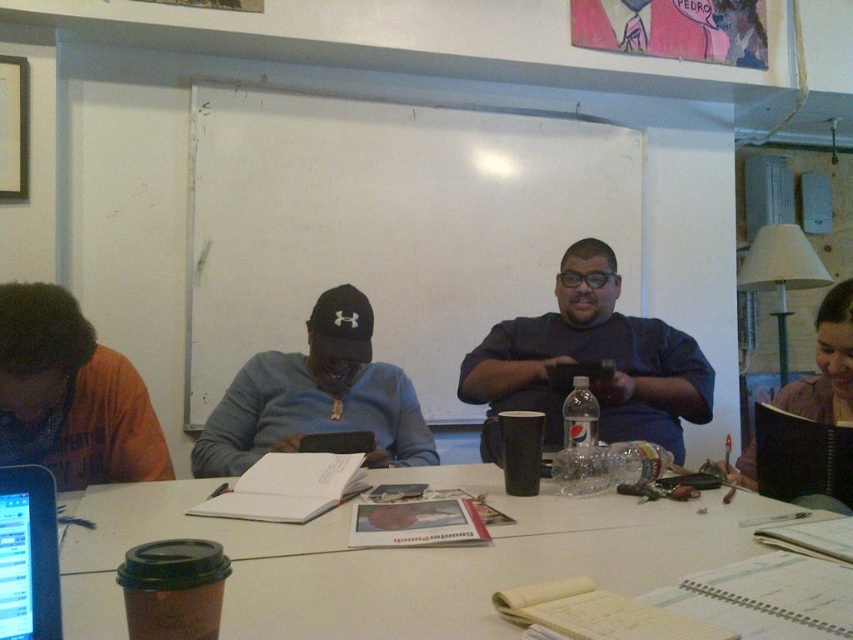
You are organizing the items on the table and need to place the pink fabric notebook at right in a position relative to the white matte whiteboard at center. Based on the scene description, where should you place it?

The white matte whiteboard at center is above the pink fabric notebook at right, so you should place the pink fabric notebook at right below the white matte whiteboard at center.

You are organizing a meeting in this room and need to place a new agenda sheet on the table. The black matte cap at center is blocking the space where you want to put it. Can you move the agenda sheet to the right side of the white matte whiteboard at center instead?

The white matte whiteboard at center is to the right of the black matte cap at center, so moving the agenda sheet to the right side of the white matte whiteboard at center would place it further to the right, which might not be the desired location. Consider checking the available space to the left of the whiteboard or another area on the table.

You are organizing a meeting and need to ensure that the orange cotton shirt at left and the pink fabric notebook at right are visible to all participants. Given their sizes, which item might be partially hidden if placed behind the other?

The pink fabric notebook at right is shorter than the orange cotton shirt at left, so placing the notebook behind the shirt could partially hide it.